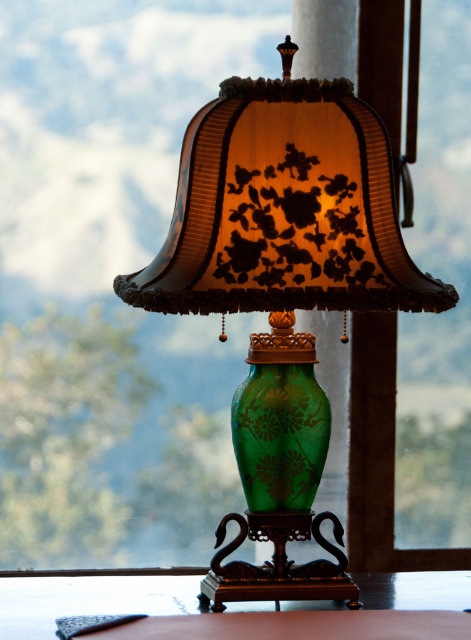
Question: Which point appears farthest from the camera in this image?

Choices:
 (A) (276, 211)
 (B) (40, 609)

Answer: (B)

Question: Can you confirm if green glass vase at center is thinner than green glass table at center?

Choices:
 (A) no
 (B) yes

Answer: (B)

Question: Which point is closer to the camera taking this photo?

Choices:
 (A) (364, 573)
 (B) (132, 296)

Answer: (B)

Question: Among these objects, which one is nearest to the camera?

Choices:
 (A) green glass table at center
 (B) green glass vase at center

Answer: (B)

Question: Is green glass vase at center further to camera compared to green glass table at center?

Choices:
 (A) yes
 (B) no

Answer: (B)

Question: Does green glass vase at center have a lesser width compared to green glass table at center?

Choices:
 (A) yes
 (B) no

Answer: (A)